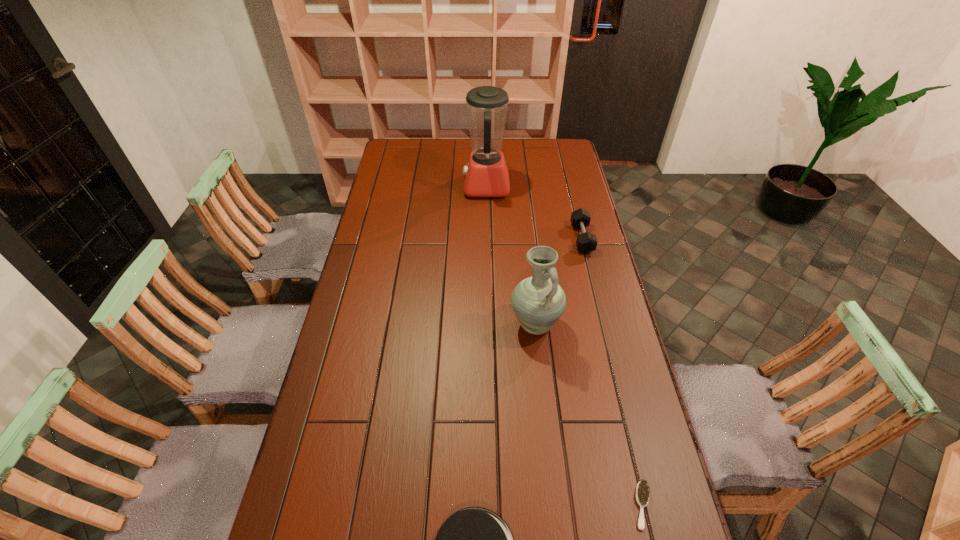
Locate an element on the screen. The width and height of the screenshot is (960, 540). blank area located on the handle side of the third nearest object is located at coordinates (545, 414).

Locate an element on the screen. The width and height of the screenshot is (960, 540). free space located on the left of the third tallest object is located at coordinates (535, 238).

The image size is (960, 540). What are the coordinates of `vacant space located 0.290m on the left of the scrubbing brush` in the screenshot? It's located at (512, 505).

Where is `dumbbell that is at the right edge`? dumbbell that is at the right edge is located at coordinates (586, 242).

The image size is (960, 540). What are the coordinates of `scrubbing brush present at the right edge` in the screenshot? It's located at (642, 490).

The image size is (960, 540). In order to click on vacant space at the left edge in this screenshot , I will do `click(340, 420)`.

What are the coordinates of `free region at the right edge` in the screenshot? It's located at (628, 348).

Locate an element on the screen. The width and height of the screenshot is (960, 540). vacant space at the far left corner of the desktop is located at coordinates (393, 141).

Image resolution: width=960 pixels, height=540 pixels. Find the location of `vacant space at the far right corner of the desktop`. vacant space at the far right corner of the desktop is located at coordinates (564, 144).

Where is `empty space between the second farthest object and the shortest object`? empty space between the second farthest object and the shortest object is located at coordinates (612, 372).